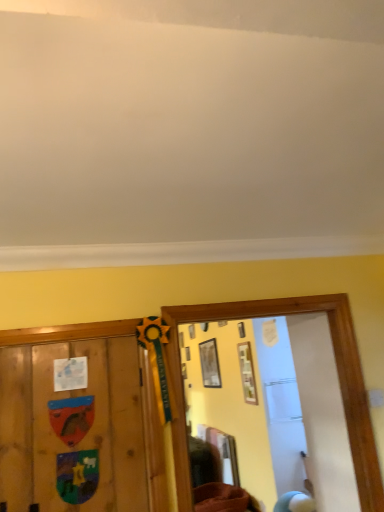
Question: Which direction should I rotate to look at matte white picture frame at center, arranged as the 1th picture frame when viewed from the right, — up or down?

Choices:
 (A) down
 (B) up

Answer: (A)

Question: Is wooden picture frame at upper center, positioned as the 3th picture frame in front-to-back order, at the left side of matte white picture frame at center, the 3th picture frame in the back-to-front sequence?

Choices:
 (A) yes
 (B) no

Answer: (A)

Question: Is wooden picture frame at upper center, positioned as the 3th picture frame in front-to-back order, outside matte white picture frame at center, arranged as the 1th picture frame when viewed from the right?

Choices:
 (A) no
 (B) yes

Answer: (B)

Question: Could you tell me if wooden picture frame at upper center, which appears as the 1th picture frame when viewed from the left, is turned towards matte white picture frame at center, the 3th picture frame in the back-to-front sequence?

Choices:
 (A) yes
 (B) no

Answer: (B)

Question: Does wooden picture frame at upper center, which is counted as the 1th picture frame, starting from the back, lie in front of matte white picture frame at center, arranged as the 1th picture frame when viewed from the right?

Choices:
 (A) yes
 (B) no

Answer: (B)

Question: Can you confirm if wooden picture frame at upper center, positioned as the 3th picture frame in front-to-back order, is taller than matte white picture frame at center, the 3th picture frame in the back-to-front sequence?

Choices:
 (A) yes
 (B) no

Answer: (A)

Question: Does wooden picture frame at upper center, which is counted as the 1th picture frame, starting from the back, have a larger size compared to matte white picture frame at center, the 3th picture frame in the back-to-front sequence?

Choices:
 (A) yes
 (B) no

Answer: (A)

Question: Can you confirm if brown fabric at lower center is bigger than wooden picture frame at upper center, positioned as the 3th picture frame in front-to-back order?

Choices:
 (A) yes
 (B) no

Answer: (A)

Question: Is the depth of brown fabric at lower center greater than that of wooden picture frame at upper center, the 3th picture frame from the right?

Choices:
 (A) no
 (B) yes

Answer: (A)

Question: Is brown fabric at lower center oriented away from wooden picture frame at upper center, which is counted as the 1th picture frame, starting from the back?

Choices:
 (A) yes
 (B) no

Answer: (B)

Question: Is brown fabric at lower center positioned far away from wooden picture frame at upper center, the 3th picture frame from the right?

Choices:
 (A) no
 (B) yes

Answer: (B)

Question: Does brown fabric at lower center have a lesser height compared to wooden picture frame at upper center, positioned as the 3th picture frame in front-to-back order?

Choices:
 (A) yes
 (B) no

Answer: (A)

Question: Is brown fabric at lower center oriented towards wooden picture frame at upper center, positioned as the 3th picture frame in front-to-back order?

Choices:
 (A) yes
 (B) no

Answer: (B)

Question: Is matte wooden picture frame at upper center, acting as the 2th picture frame starting from the front, at the left side of brown fabric at lower center?

Choices:
 (A) no
 (B) yes

Answer: (A)